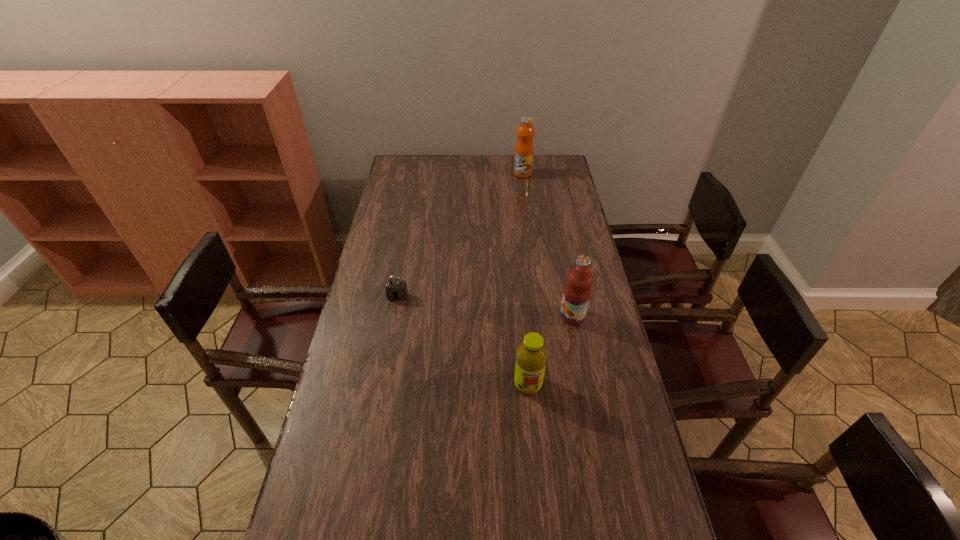
What are the coordinates of `the farthest object` in the screenshot? It's located at (524, 150).

The image size is (960, 540). I want to click on the second nearest fruit juice, so click(577, 291).

Where is `the third farthest object`? This screenshot has height=540, width=960. the third farthest object is located at coordinates (577, 291).

Locate an element on the screen. This screenshot has height=540, width=960. the nearest fruit juice is located at coordinates [x=531, y=356].

Identify the location of the shortest fruit juice. (531, 356).

At what (x,y) coordinates should I click in order to perform the action: click on the shortest object. Please return your answer as a coordinate pair (x, y). This screenshot has width=960, height=540. Looking at the image, I should click on (396, 290).

Find the location of a particular element. The height and width of the screenshot is (540, 960). padlock is located at coordinates (396, 290).

This screenshot has height=540, width=960. Identify the location of vacant space situated on the front of the farthest fruit juice. (526, 200).

Identify the location of vacant point located 0.090m on the front label of the third farthest object. (534, 316).

I want to click on vacant space positioned on the front label of the third farthest object, so click(522, 316).